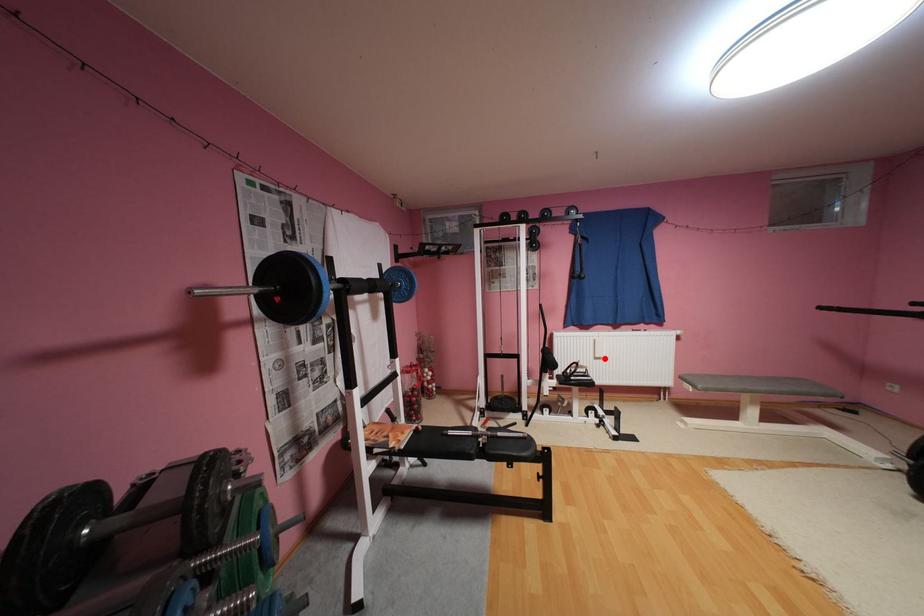
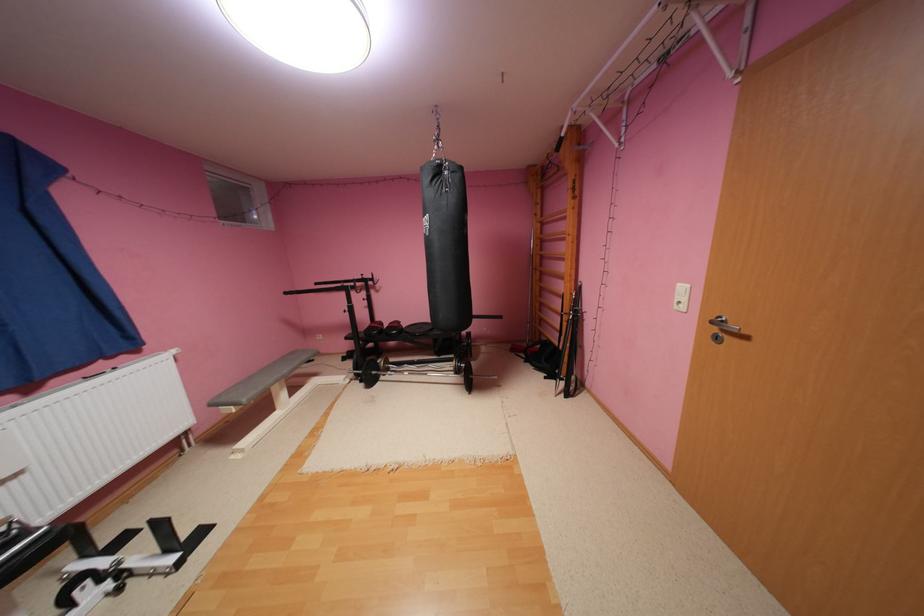
In the second image, find the point that corresponds to the highlighted location in the first image.

(11, 483)